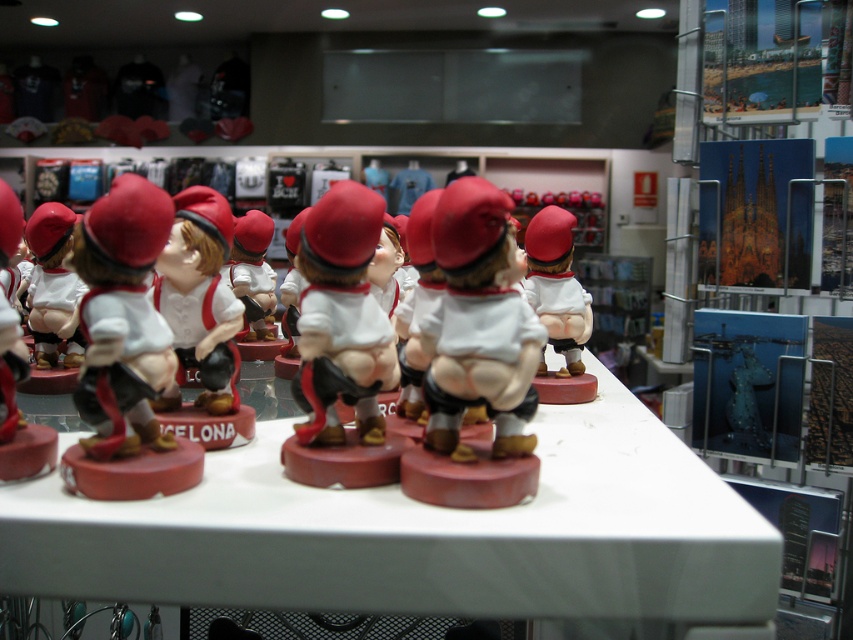
Question: Does white glossy table at center lie behind matte white figurine at center?

Choices:
 (A) yes
 (B) no

Answer: (B)

Question: Which object is farther from the camera taking this photo?

Choices:
 (A) matte white figurine at center
 (B) white glossy table at center

Answer: (A)

Question: Among these objects, which one is farthest from the camera?

Choices:
 (A) matte white figurine at center
 (B) white glossy table at center

Answer: (A)

Question: Is white glossy table at center smaller than matte white figurine at center?

Choices:
 (A) no
 (B) yes

Answer: (A)

Question: Which object is closer to the camera taking this photo?

Choices:
 (A) white glossy table at center
 (B) matte white figurine at center

Answer: (A)

Question: Is white glossy table at center above matte white figurine at center?

Choices:
 (A) yes
 (B) no

Answer: (B)